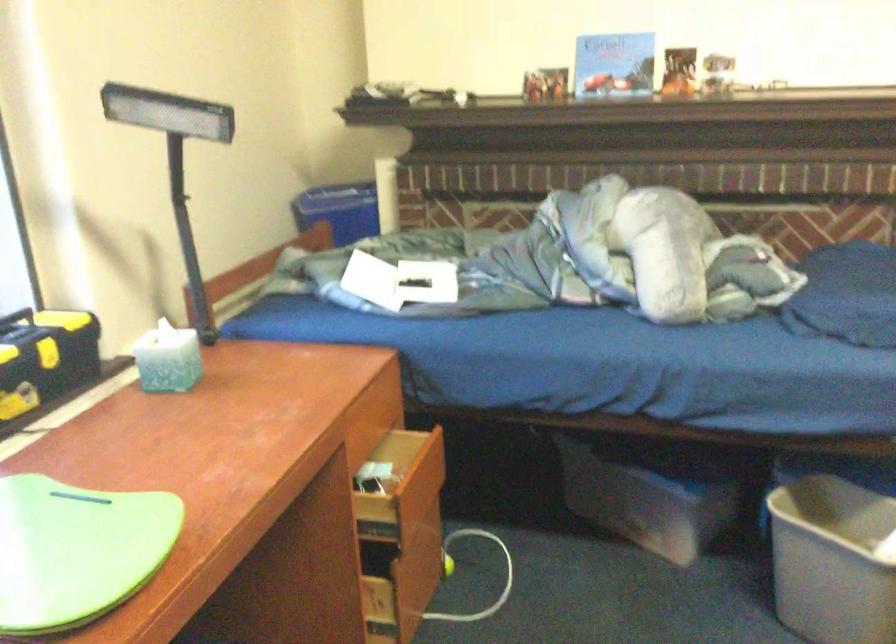
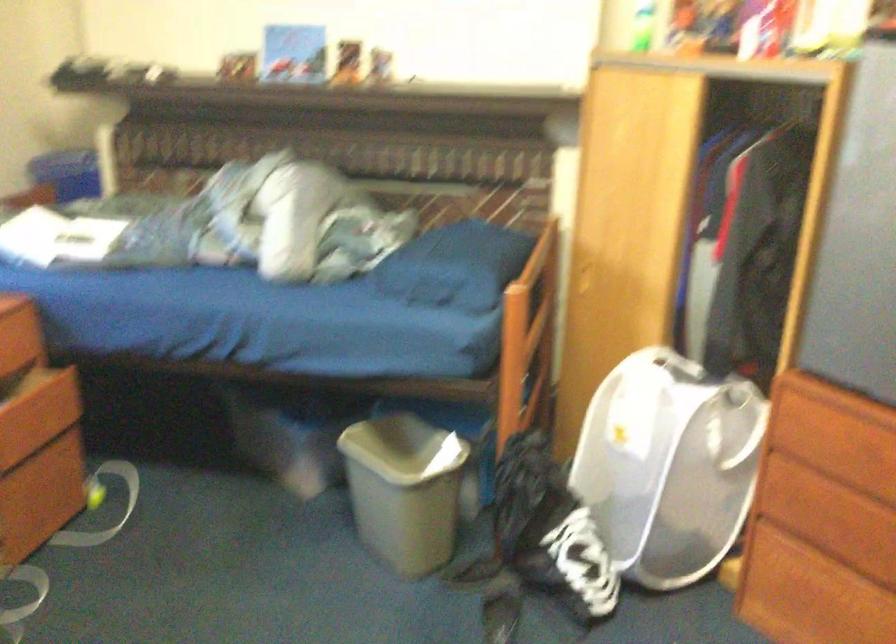
Question: The camera is either moving clockwise (left) or counter-clockwise (right) around the object. The first image is from the beginning of the video and the second image is from the end. Is the camera moving left or right when shooting the video?

Choices:
 (A) Left
 (B) Right

Answer: (A)